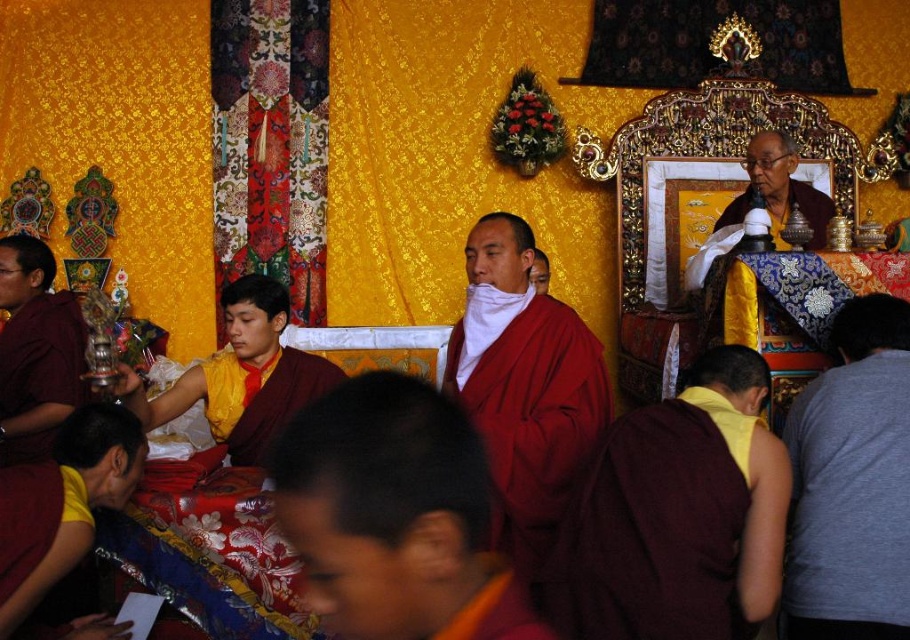
Question: Which point is closer to the camera?

Choices:
 (A) yellow silk robe at center
 (B) gray cotton shirt at lower right
 (C) yellow silk monk at left
 (D) yellow cotton monk at lower right

Answer: (D)

Question: Is matte red robe at center thinner than maroon robe at lower left?

Choices:
 (A) no
 (B) yes

Answer: (A)

Question: Which object appears closest to the camera in this image?

Choices:
 (A) matte red robe at left
 (B) matte red robe at center
 (C) gray cotton shirt at lower right

Answer: (B)

Question: Can you confirm if gray cotton shirt at lower right is positioned above matte red robe at left?

Choices:
 (A) yes
 (B) no

Answer: (B)

Question: In this image, where is maroon silk robe at center located relative to maroon robe at lower left?

Choices:
 (A) above
 (B) below

Answer: (B)

Question: Which is farther from the yellow cotton monk at lower right?

Choices:
 (A) matte red robe at left
 (B) yellow silk robe at center

Answer: (A)